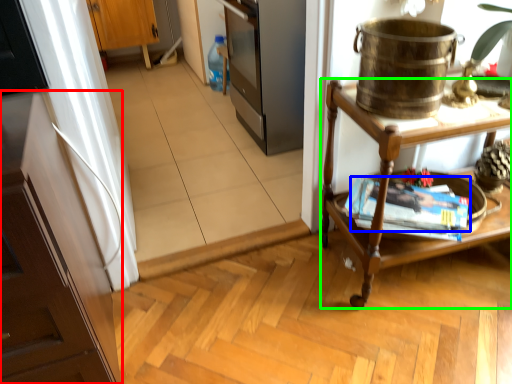
Question: Based on their relative distances, which object is nearer to cabinetry (highlighted by a red box)? Choose from magazine (highlighted by a blue box) and desk (highlighted by a green box).

Choices:
 (A) magazine
 (B) desk

Answer: (B)